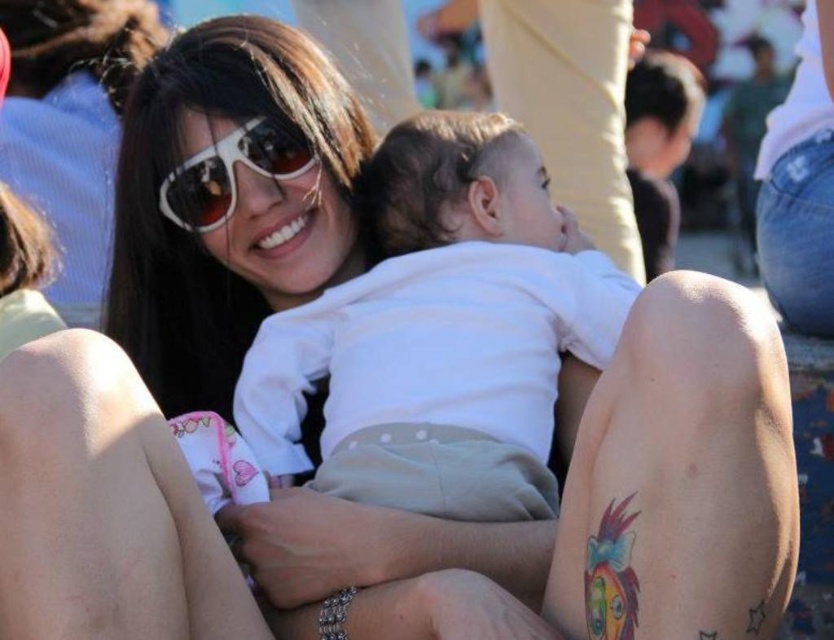
Who is higher up, white soft fabric baby at center or white glossy sunglasses at upper center?

white glossy sunglasses at upper center is higher up.

Measure the distance between point (541, 424) and camera.

Point (541, 424) is 102.21 feet away from camera.

Measure the distance between white soft fabric baby at center and camera.

The distance of white soft fabric baby at center from camera is 94.13 feet.

Find the location of a particular element. The width and height of the screenshot is (834, 640). white soft fabric baby at center is located at coordinates (445, 316).